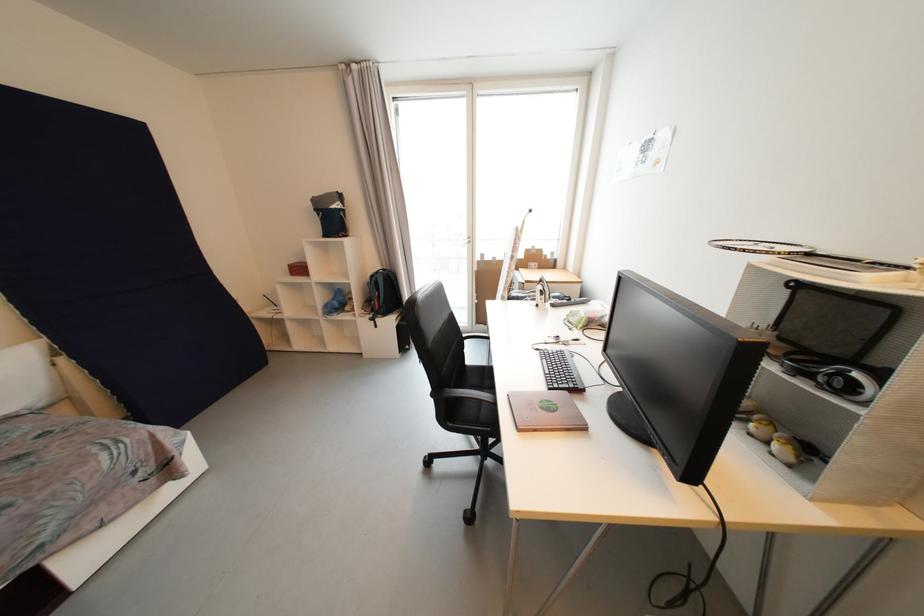
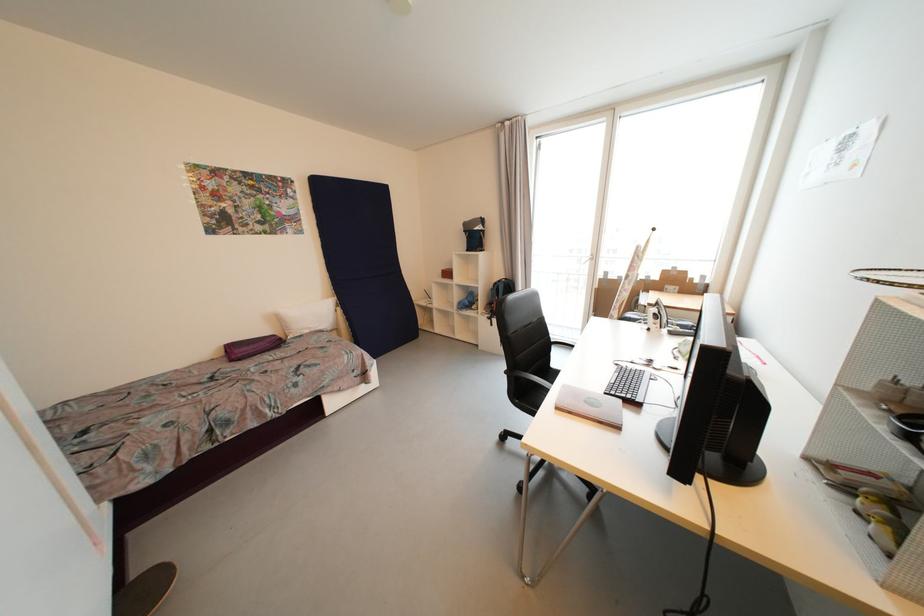
The point at (x=67, y=361) is marked in the first image. Where is the corresponding point in the second image?

(344, 310)